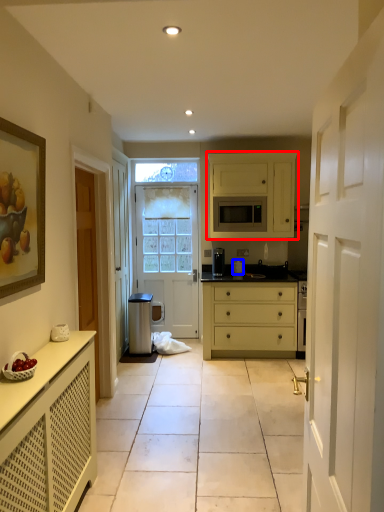
Question: Which object appears farthest to the camera in this image, cabinetry (highlighted by a red box) or appliance (highlighted by a blue box)?

Choices:
 (A) cabinetry
 (B) appliance

Answer: (B)